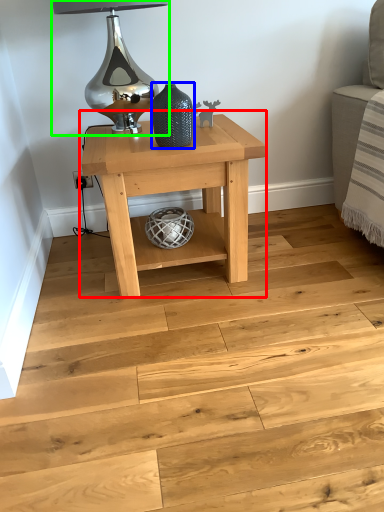
Question: Which object is the farthest from table (highlighted by a red box)? Choose among these: vase (highlighted by a blue box) or table lamp (highlighted by a green box).

Choices:
 (A) vase
 (B) table lamp

Answer: (B)